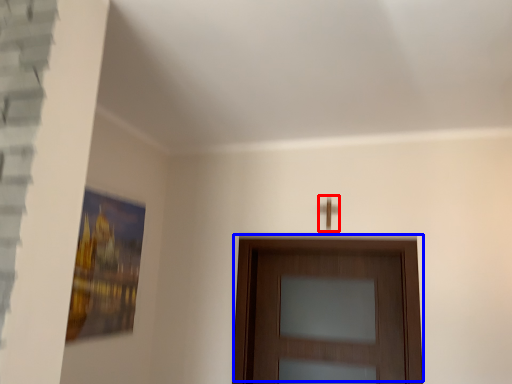
Question: Among these objects, which one is farthest to the camera, door handle (highlighted by a red box) or door (highlighted by a blue box)?

Choices:
 (A) door handle
 (B) door

Answer: (A)